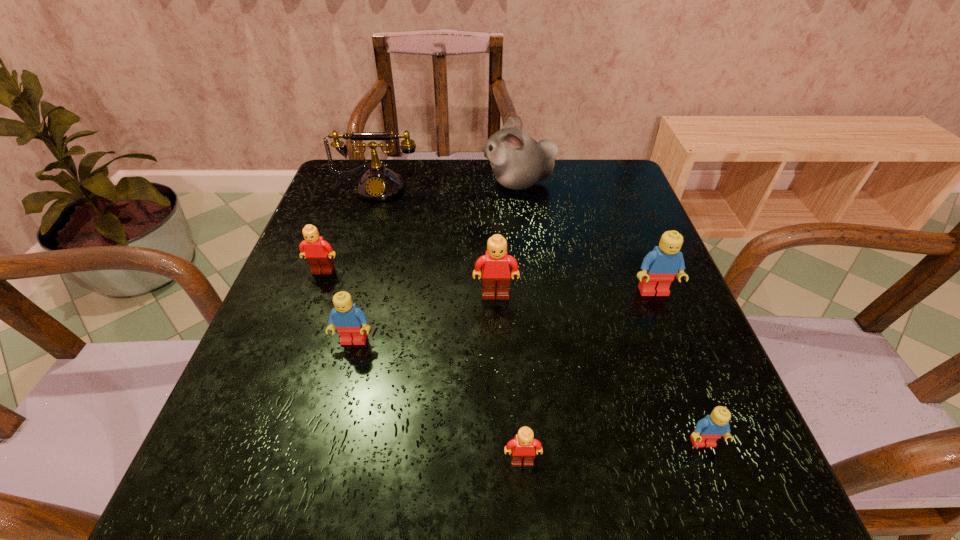
Find the location of a particular element. This screenshot has height=540, width=960. free location located on the face of the nearest blue Lego is located at coordinates (722, 493).

The width and height of the screenshot is (960, 540). Find the location of `hamster that is at the far edge`. hamster that is at the far edge is located at coordinates (518, 161).

Locate an element on the screen. The image size is (960, 540). telephone present at the far edge is located at coordinates (378, 184).

In order to click on object that is positioned at the near edge in this screenshot , I will do `click(522, 447)`.

You are a GUI agent. You are given a task and a screenshot of the screen. Output one action in this format:
    pyautogui.click(x=<x>, y=<y>)
    Task: Click on the telephone present at the left edge
    This screenshot has width=960, height=540.
    Given the screenshot: What is the action you would take?
    pyautogui.click(x=378, y=184)

The image size is (960, 540). Identify the location of object at the far left corner. (378, 184).

Identify the location of vacant area at the far edge of the desktop. Image resolution: width=960 pixels, height=540 pixels. (564, 194).

You are a GUI agent. You are given a task and a screenshot of the screen. Output one action in this format:
    pyautogui.click(x=<x>, y=<y>)
    Task: Click on the vacant point at the near edge
    The height and width of the screenshot is (540, 960).
    Given the screenshot: What is the action you would take?
    pyautogui.click(x=322, y=504)

At what (x,y) coordinates should I click in order to perform the action: click on free space at the left edge. Please return your answer as a coordinate pair (x, y). Looking at the image, I should click on (348, 208).

The height and width of the screenshot is (540, 960). Identify the location of free region at the right edge of the desktop. (615, 322).